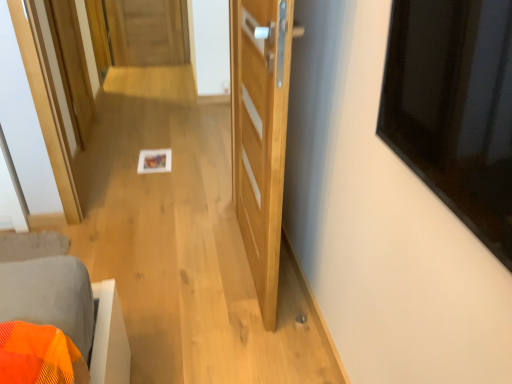
This screenshot has height=384, width=512. In order to click on vacant region to the left of natural wood door at center in this screenshot , I will do `click(170, 259)`.